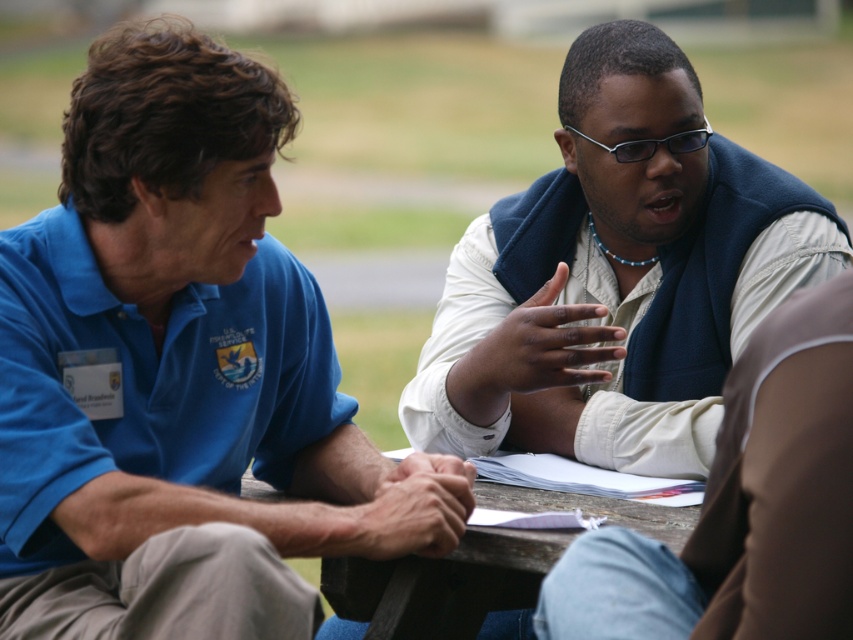
You are a tailor who needs to determine which item requires more fabric for alterations. Given the blue cotton shirt at left and the light beige vest at center, which one would need more fabric due to its thickness?

The light beige vest at center requires more fabric for alterations because it is thicker than the blue cotton shirt at left.

You are standing at the origin point of the coordinate system where the table is located. The table has a coordinate system with the origin at its center. The blue cotton shirt at left is at point (180, 372). If you want to move directly to the blue cotton shirt at left, in which direction should you move from the origin?

The blue cotton shirt at left is located at coordinates (180, 372). Since the origin is at the center of the table, moving towards the positive x and positive y direction would lead you to the blue cotton shirt at left.

Based on the scene description, can you determine if the blue cotton shirt at left is positioned higher than the wooden table at center?

Yes, the blue cotton shirt at left is above the wooden table at center, so it is positioned higher than the table.